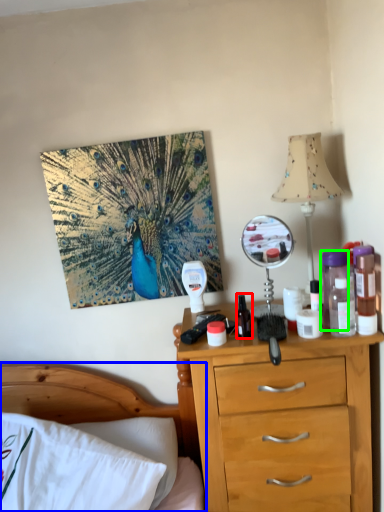
Question: Which is nearer to the bottle (highlighted by a red box)? bed (highlighted by a blue box) or bottle (highlighted by a green box).

Choices:
 (A) bed
 (B) bottle

Answer: (B)